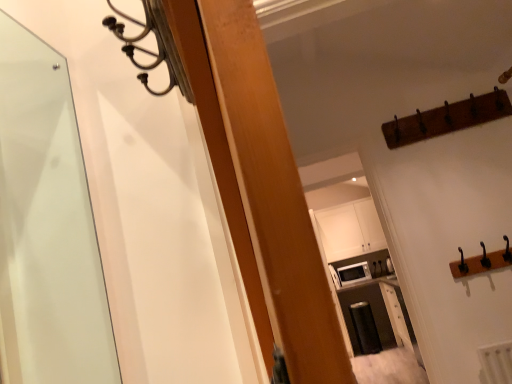
Question: Considering the positions of point (353, 264) and point (346, 233), is point (353, 264) closer or farther from the camera than point (346, 233)?

Choices:
 (A) closer
 (B) farther

Answer: (A)

Question: Looking at the image, does white glossy microwave at upper center seem bigger or smaller compared to white matte cabinet at upper center?

Choices:
 (A) small
 (B) big

Answer: (A)

Question: From the image's perspective, relative to white matte cabinet at upper center, is white glossy microwave at upper center above or below?

Choices:
 (A) below
 (B) above

Answer: (A)

Question: From their relative heights in the image, would you say white matte cabinet at upper center is taller or shorter than white glossy microwave at upper center?

Choices:
 (A) tall
 (B) short

Answer: (A)

Question: Is point (330, 215) closer or farther from the camera than point (352, 281)?

Choices:
 (A) closer
 (B) farther

Answer: (B)

Question: Looking at their shapes, would you say white matte cabinet at upper center is wider or thinner than white glossy microwave at upper center?

Choices:
 (A) thin
 (B) wide

Answer: (A)

Question: Is white matte cabinet at upper center to the left or to the right of white glossy microwave at upper center in the image?

Choices:
 (A) left
 (B) right

Answer: (A)